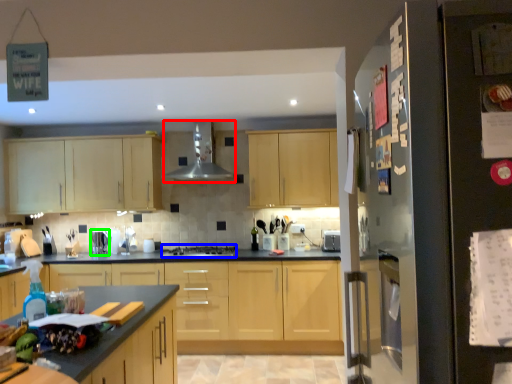
Question: Based on their relative distances, which object is farther from exhaust hood (highlighted by a red box)? Choose from gas stove (highlighted by a blue box) and appliance (highlighted by a green box).

Choices:
 (A) gas stove
 (B) appliance

Answer: (B)